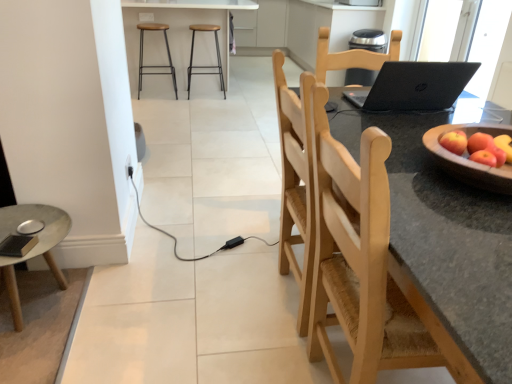
At what (x,y) coordinates should I click in order to perform the action: click on free space above matte wooden desk at lower left (from a real-world perspective). Please return your answer as a coordinate pair (x, y). Looking at the image, I should click on (30, 220).